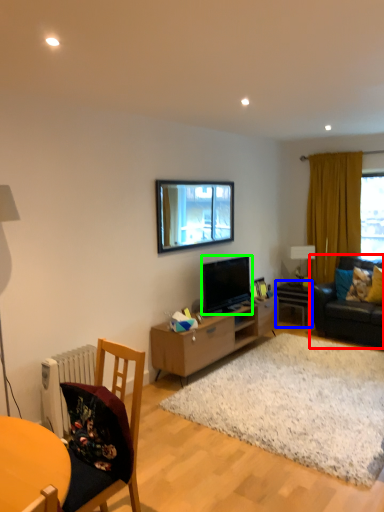
Question: Based on their relative distances, which object is farther from studio couch (highlighted by a red box)? Choose from table (highlighted by a blue box) and television (highlighted by a green box).

Choices:
 (A) table
 (B) television

Answer: (B)